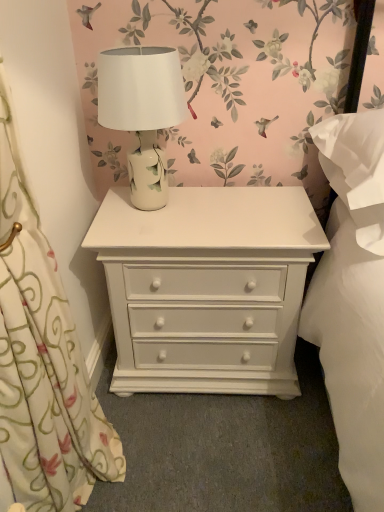
Question: Which direction should I rotate to look at white painted wood chest of drawers at center?

Choices:
 (A) right
 (B) left

Answer: (A)

Question: Is white floral fabric at left taller than white ceramic table lamp at center?

Choices:
 (A) no
 (B) yes

Answer: (B)

Question: Is white floral fabric at left next to white ceramic table lamp at center?

Choices:
 (A) no
 (B) yes

Answer: (A)

Question: Can you confirm if white floral fabric at left is bigger than white ceramic table lamp at center?

Choices:
 (A) no
 (B) yes

Answer: (B)

Question: Would you consider white floral fabric at left to be distant from white ceramic table lamp at center?

Choices:
 (A) yes
 (B) no

Answer: (B)

Question: Is white floral fabric at left shorter than white ceramic table lamp at center?

Choices:
 (A) yes
 (B) no

Answer: (B)

Question: Is white floral fabric at left facing away from white ceramic table lamp at center?

Choices:
 (A) yes
 (B) no

Answer: (B)

Question: Can you confirm if white painted wood chest of drawers at center is smaller than white floral fabric at left?

Choices:
 (A) yes
 (B) no

Answer: (B)

Question: Can you confirm if white painted wood chest of drawers at center is shorter than white floral fabric at left?

Choices:
 (A) no
 (B) yes

Answer: (B)

Question: Is white painted wood chest of drawers at center placed right next to white floral fabric at left?

Choices:
 (A) yes
 (B) no

Answer: (B)

Question: Is white painted wood chest of drawers at center oriented away from white floral fabric at left?

Choices:
 (A) no
 (B) yes

Answer: (A)

Question: Is white painted wood chest of drawers at center facing towards white floral fabric at left?

Choices:
 (A) yes
 (B) no

Answer: (A)

Question: From a real-world perspective, is white painted wood chest of drawers at center positioned under white floral fabric at left based on gravity?

Choices:
 (A) yes
 (B) no

Answer: (A)

Question: From a real-world perspective, is white painted wood chest of drawers at center physically above white ceramic table lamp at center?

Choices:
 (A) yes
 (B) no

Answer: (B)